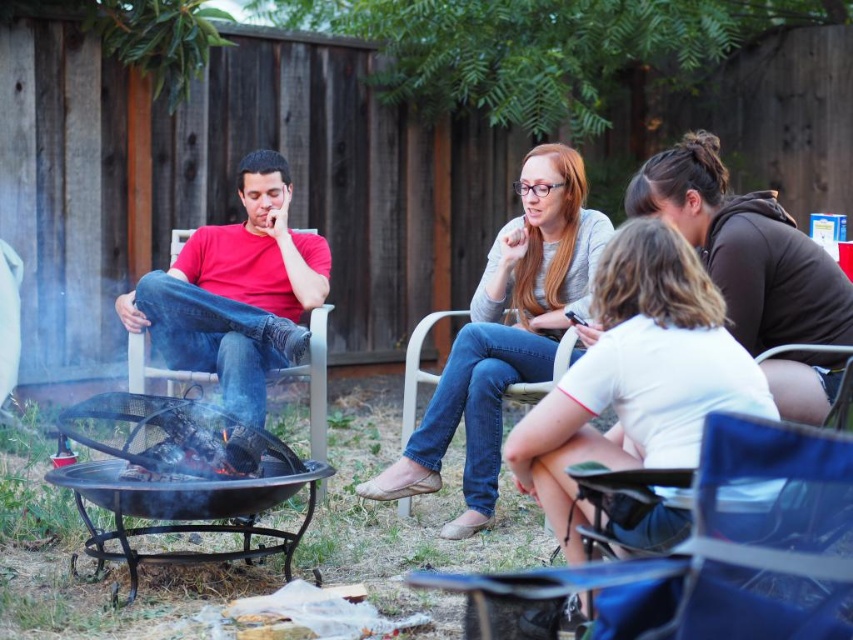
Question: Is black wrought iron fire pit at lower left positioned before matte red shirt at center?

Choices:
 (A) yes
 (B) no

Answer: (A)

Question: Which of these objects is positioned farthest from the black wrought iron fire pit at lower left?

Choices:
 (A) dark brown hoodie at right
 (B) denim jeans at center

Answer: (A)

Question: Does matte red shirt at center have a larger size compared to dark brown hoodie at right?

Choices:
 (A) no
 (B) yes

Answer: (A)

Question: Which object is closer to the camera taking this photo?

Choices:
 (A) matte red shirt at center
 (B) dark brown hoodie at right
 (C) denim jeans at center

Answer: (B)

Question: Which point appears farthest from the camera in this image?

Choices:
 (A) (637, 400)
 (B) (241, 524)
 (C) (746, 252)
 (D) (244, 256)

Answer: (D)

Question: Is white cotton shirt at center further to camera compared to matte red shirt at center?

Choices:
 (A) no
 (B) yes

Answer: (A)